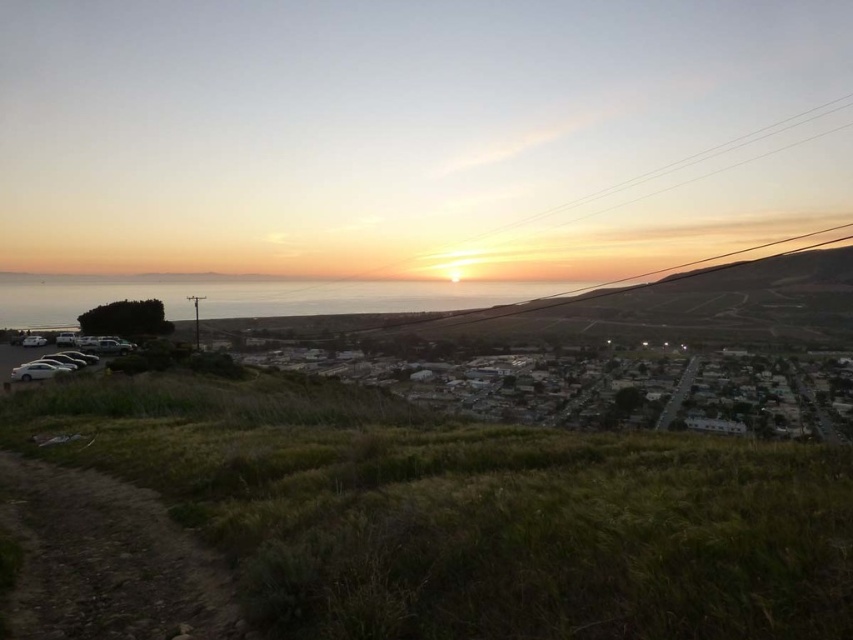
You are standing at the center of the image and want to walk towards the green grassy hillside at lower left. In which direction should you move?

→ You should move to the lower left direction to reach the green grassy hillside at lower left.

You are standing at the viewpoint overlooking the coastal town and want to take a photo. You notice two points in the scene labeled as point 1 and point 2. The first point is at coordinates point (408, 577), and the second point is at point (419, 275). Which point appears closer to you when looking through the camera view?

Point (408, 577) is closer to the camera than point (419, 275), so it will appear closer in the camera view.